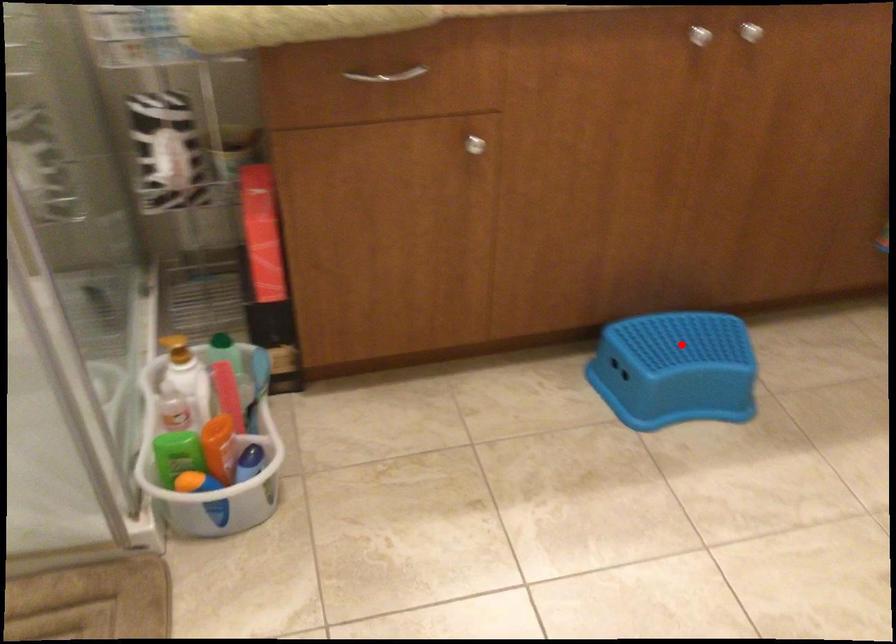
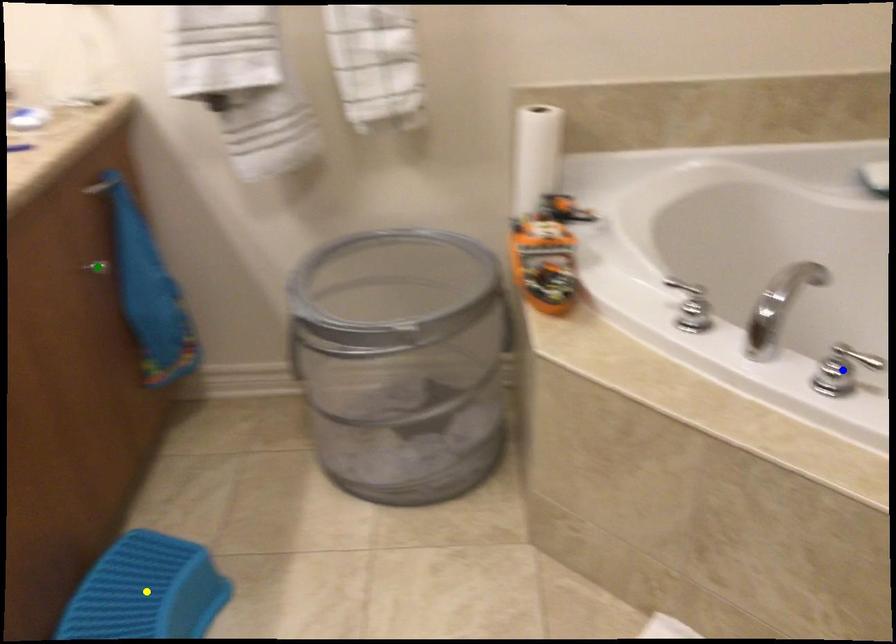
Question: I am providing you with two images of the same scene from different viewpoints. A red point is marked on the first image. You are given multiple points on the second image. Which point in image 2 is actually the same real-world point as the red point in image 1?

Choices:
 (A) yellow point
 (B) green point
 (C) blue point

Answer: (A)